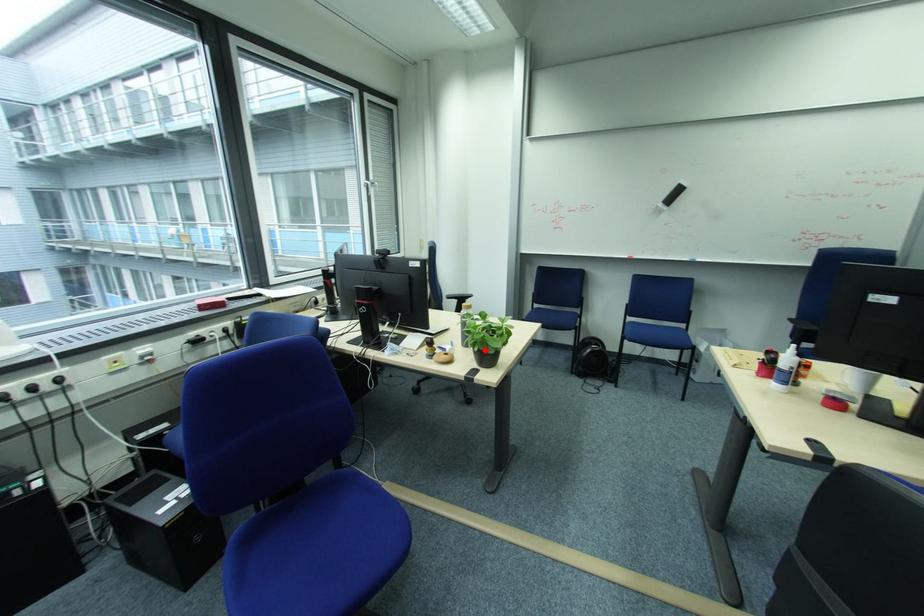
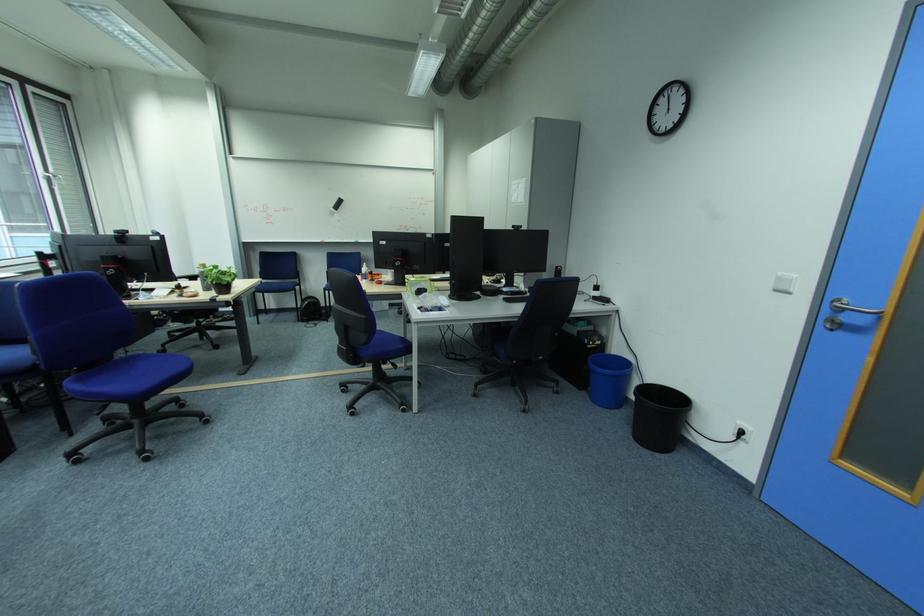
Question: I am providing you with two images of the same scene from different viewpoints. A red point is shown in image1. For the corresponding object point in image2, is it positioned nearer or farther from the camera?

Choices:
 (A) Nearer
 (B) Farther

Answer: (A)